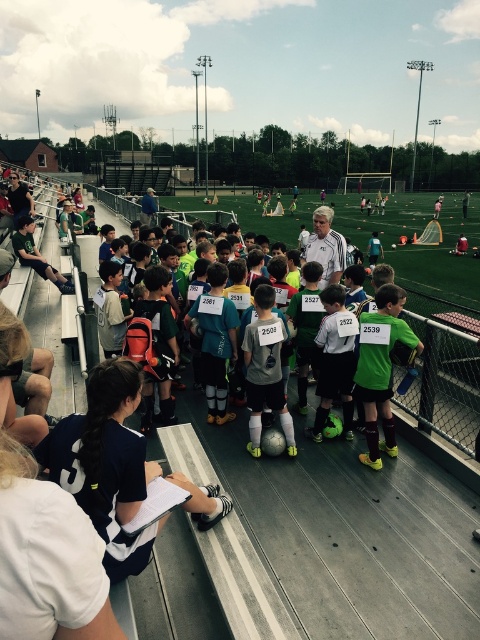
Can you confirm if teal jersey at center is positioned above matte black jacket at left?

No.

Can you confirm if teal jersey at center is thinner than matte black jacket at left?

Correct, teal jersey at center's width is less than matte black jacket at left's.

Is point (210, 394) less distant than point (16, 241)?

Yes, point (210, 394) is in front of point (16, 241).

At what (x,y) coordinates should I click in order to perform the action: click on teal jersey at center. Please return your answer as a coordinate pair (x, y). Looking at the image, I should click on (215, 340).

Is dark blue jersey at lower left thinner than matte gray jersey at center?

Incorrect, dark blue jersey at lower left's width is not less than matte gray jersey at center's.

Does point (122, 385) come closer to viewer compared to point (265, 381)?

Yes, point (122, 385) is closer to viewer.

Find the location of a particular element. The image size is (480, 640). dark blue jersey at lower left is located at coordinates tap(106, 465).

Locate an element on the screen. The image size is (480, 640). dark blue jersey at lower left is located at coordinates (106, 465).

The height and width of the screenshot is (640, 480). Describe the element at coordinates (265, 369) in the screenshot. I see `matte gray jersey at center` at that location.

Does matte gray jersey at center have a greater height compared to teal jersey at center?

No.

Does point (256, 384) lie in front of point (212, 339)?

Yes.

Image resolution: width=480 pixels, height=640 pixels. Identify the location of matte gray jersey at center. (265, 369).